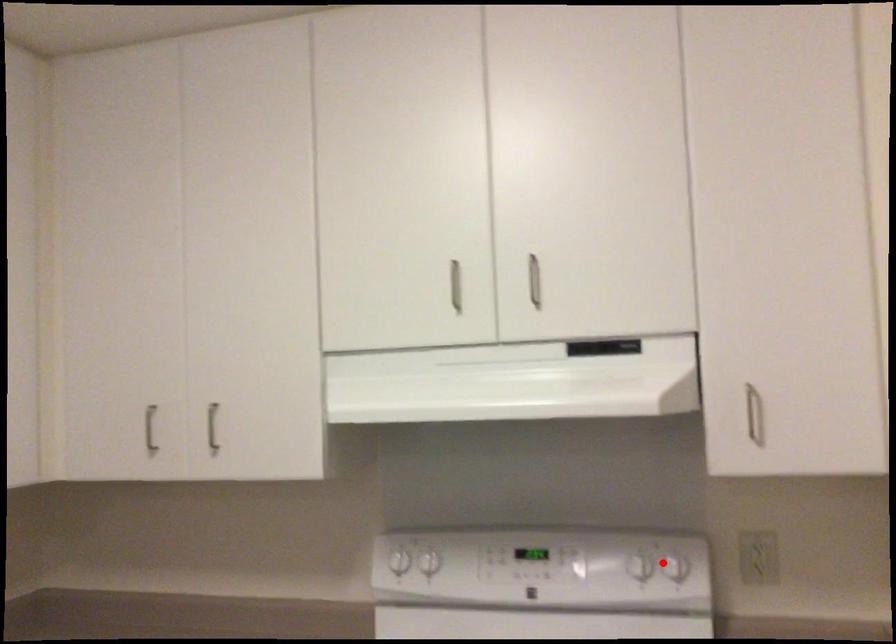
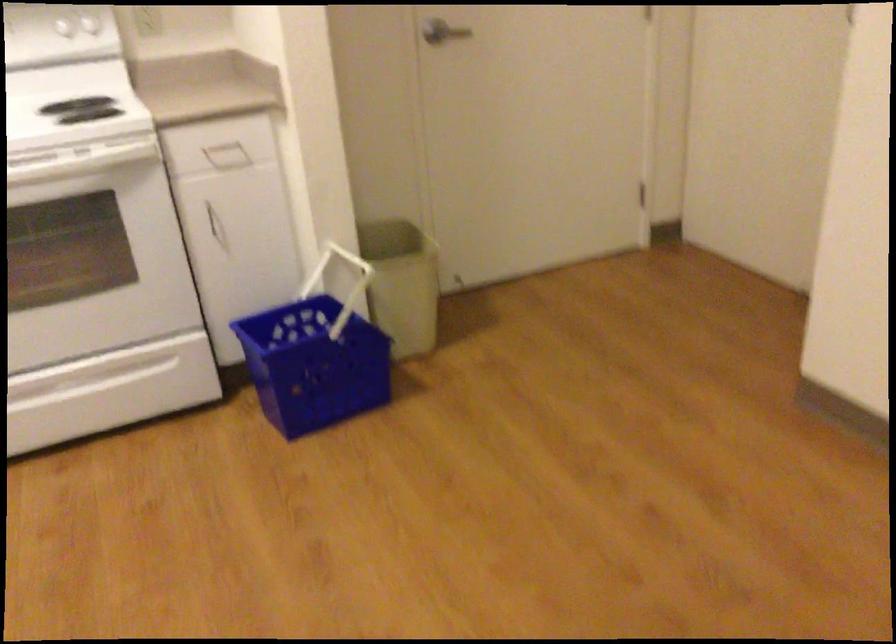
Question: I am providing you with two images of the same scene from different viewpoints. In image1, a red point is highlighted. Considering the same 3D point in image2, which of the following is correct?

Choices:
 (A) It is closer
 (B) It is farther

Answer: (B)